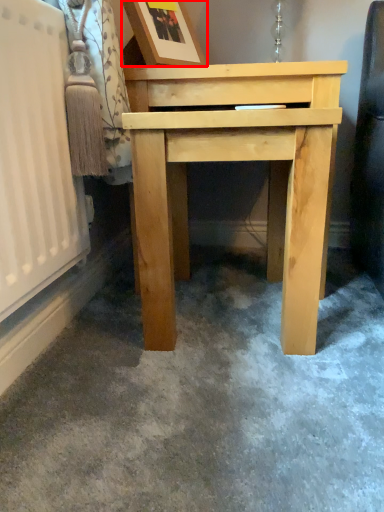
Question: From the image, what is the correct spatial relationship of picture frame (annotated by the red box) in relation to table?

Choices:
 (A) left
 (B) right

Answer: (A)